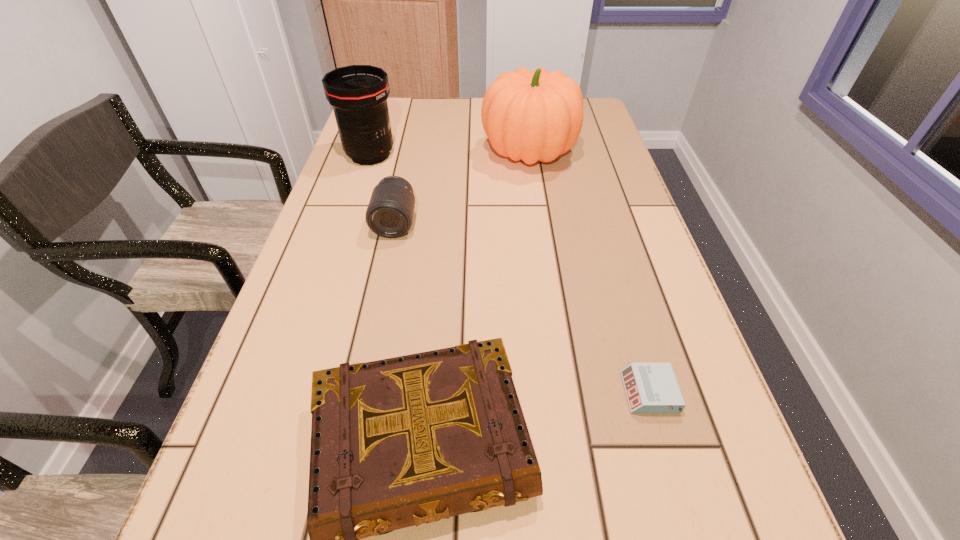
Locate an element on the screen. This screenshot has width=960, height=540. free spot between the shortest object and the third farthest object is located at coordinates (522, 307).

Identify the location of object that stands as the third closest to the shortest object. Image resolution: width=960 pixels, height=540 pixels. (535, 116).

Identify the location of object that is the closest to the hardback book. (651, 388).

This screenshot has height=540, width=960. Identify the location of free location that satisfies the following two spatial constraints: 1. on the front side of the pumpkin; 2. on the right side of the shortest object. (564, 392).

Image resolution: width=960 pixels, height=540 pixels. Identify the location of free space that satisfies the following two spatial constraints: 1. on the surface of the shortest object; 2. on the right side of the third farthest object. (359, 392).